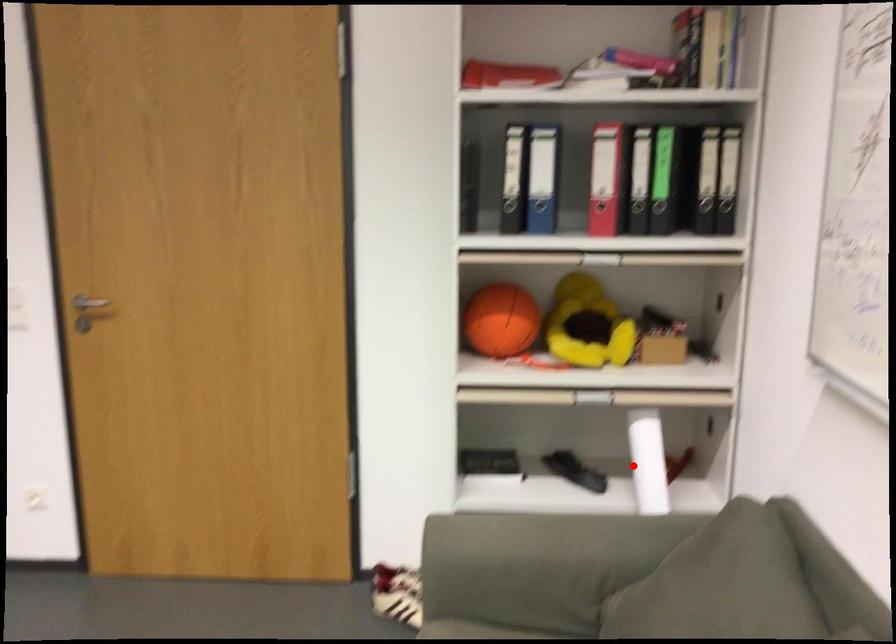
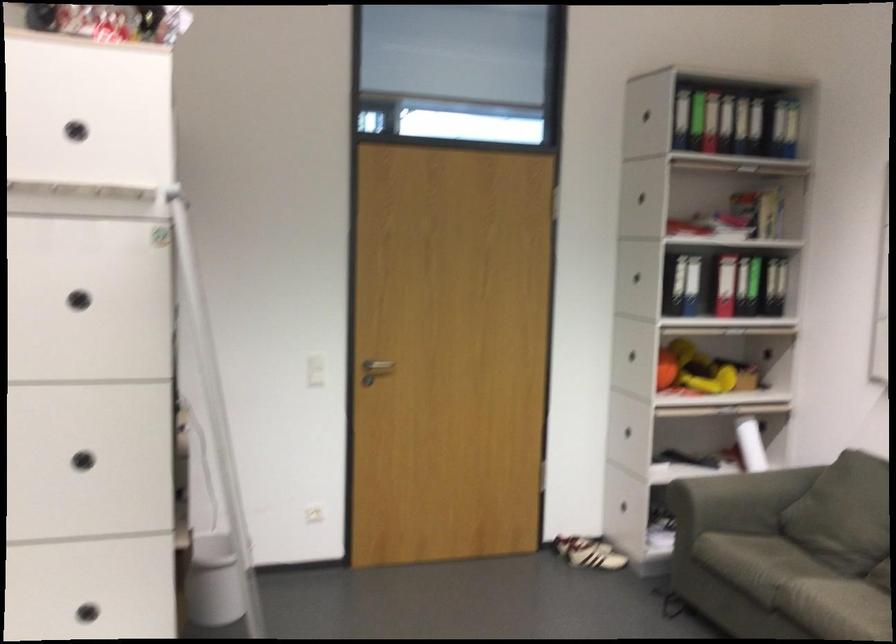
Question: I am providing you with two images of the same scene from different viewpoints. Image1 has a red point marked. In image2, the corresponding 3D location appears at what relative position? Reply with the corresponding letter.

Choices:
 (A) Closer
 (B) Farther

Answer: (B)